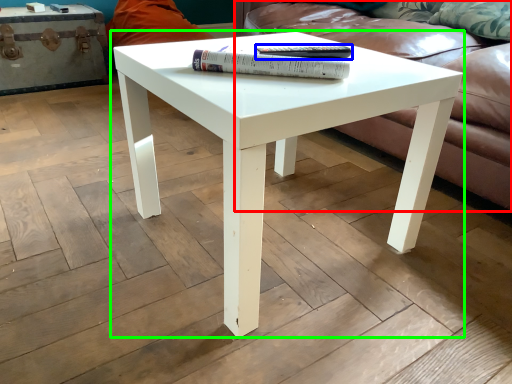
Question: Based on their relative distances, which object is farther from studio couch (highlighted by a red box)? Choose from paperback book (highlighted by a blue box) and coffee table (highlighted by a green box).

Choices:
 (A) paperback book
 (B) coffee table

Answer: (A)